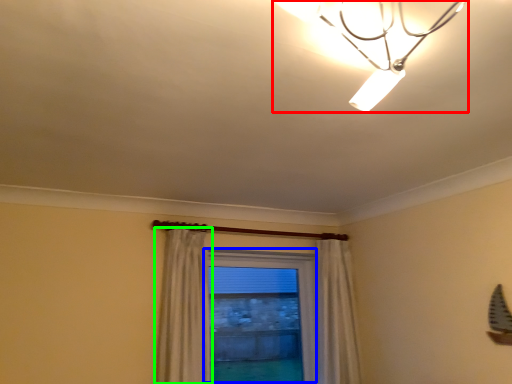
Question: Which object is positioned closest to lamp (highlighted by a red box)? Select from window (highlighted by a blue box) and curtain (highlighted by a green box).

Choices:
 (A) window
 (B) curtain

Answer: (B)